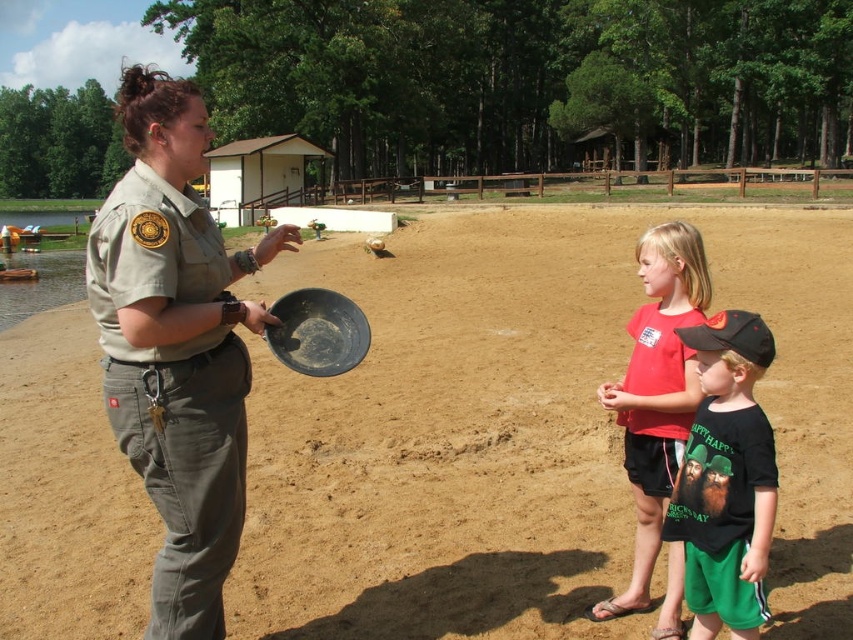
Question: Is brown sandy dirt at center wider than red matte t-shirt at center?

Choices:
 (A) yes
 (B) no

Answer: (A)

Question: Is brown sandy dirt at center above red matte t-shirt at center?

Choices:
 (A) no
 (B) yes

Answer: (B)

Question: Which point is farther from the camera taking this photo?

Choices:
 (A) (456, 476)
 (B) (647, 524)
 (C) (709, 440)

Answer: (A)

Question: Observing the image, what is the correct spatial positioning of red cotton shirt at center in reference to red matte t-shirt at center?

Choices:
 (A) below
 (B) above

Answer: (A)

Question: Considering the real-world distances, which object is closest to the red cotton shirt at center?

Choices:
 (A) brown sandy dirt at center
 (B) red matte t-shirt at center

Answer: (B)

Question: Which point is farther from the camera taking this photo?

Choices:
 (A) (689, 584)
 (B) (676, 573)
 (C) (424, 332)
 (D) (169, 301)

Answer: (C)